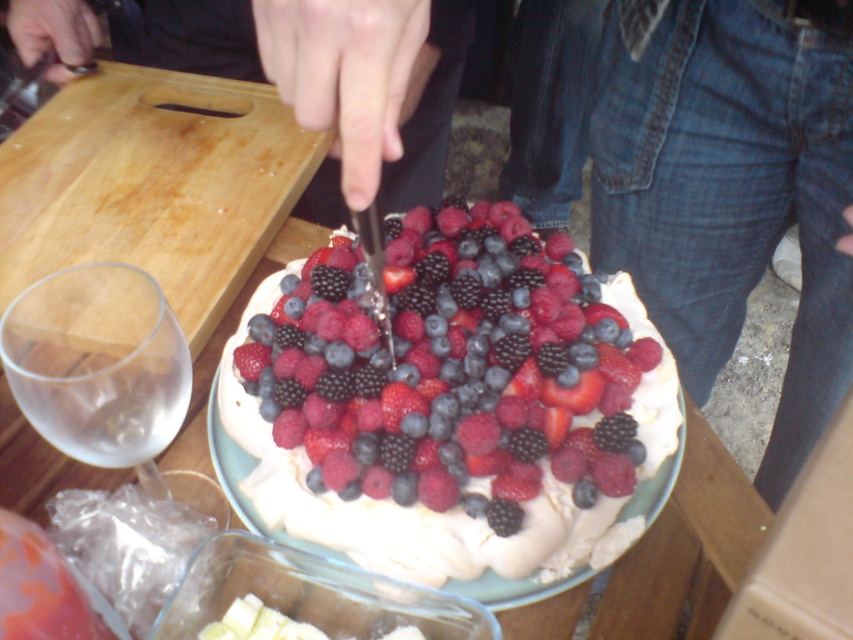
Question: Can you confirm if white fluffy cake at center is positioned to the left of transparent glass at left?

Choices:
 (A) no
 (B) yes

Answer: (A)

Question: Which point appears farthest from the camera in this image?

Choices:
 (A) (555, 576)
 (B) (633, 193)
 (C) (9, 308)

Answer: (B)

Question: Can you confirm if white fluffy cake at center is positioned to the left of jeans at center?

Choices:
 (A) yes
 (B) no

Answer: (A)

Question: Does white fluffy cake at center have a lesser width compared to transparent glass at left?

Choices:
 (A) yes
 (B) no

Answer: (B)

Question: Estimate the real-world distances between objects in this image. Which object is closer to the wooden cutting board at upper left?

Choices:
 (A) white fluffy cake at center
 (B) jeans at center

Answer: (A)

Question: Estimate the real-world distances between objects in this image. Which object is farther from the jeans at center?

Choices:
 (A) wooden cutting board at upper left
 (B) transparent glass at left
 (C) white fluffy cake at center

Answer: (B)